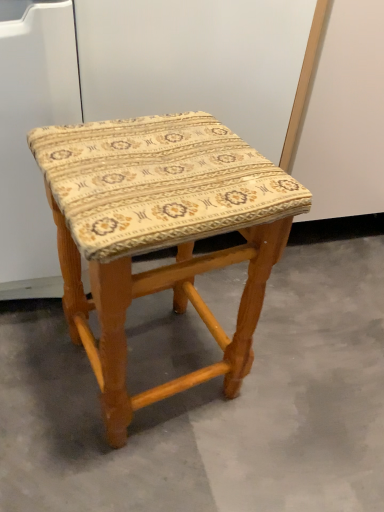
Question: Are beige fabric stool at center and wooden stool at center making contact?

Choices:
 (A) no
 (B) yes

Answer: (A)

Question: Does beige fabric stool at center appear on the right side of wooden stool at center?

Choices:
 (A) yes
 (B) no

Answer: (A)

Question: Does beige fabric stool at center have a smaller size compared to wooden stool at center?

Choices:
 (A) no
 (B) yes

Answer: (B)

Question: Does beige fabric stool at center have a lesser width compared to wooden stool at center?

Choices:
 (A) no
 (B) yes

Answer: (A)

Question: From the image's perspective, is beige fabric stool at center on top of wooden stool at center?

Choices:
 (A) yes
 (B) no

Answer: (B)

Question: Can you confirm if beige fabric stool at center is positioned to the left of wooden stool at center?

Choices:
 (A) yes
 (B) no

Answer: (B)

Question: Is wooden stool at center to the right of beige fabric stool at center from the viewer's perspective?

Choices:
 (A) yes
 (B) no

Answer: (B)

Question: Does wooden stool at center lie behind beige fabric stool at center?

Choices:
 (A) yes
 (B) no

Answer: (B)

Question: Does wooden stool at center turn towards beige fabric stool at center?

Choices:
 (A) no
 (B) yes

Answer: (A)

Question: Considering the relative sizes of wooden stool at center and beige fabric stool at center in the image provided, is wooden stool at center shorter than beige fabric stool at center?

Choices:
 (A) yes
 (B) no

Answer: (B)

Question: From the image's perspective, is wooden stool at center on top of beige fabric stool at center?

Choices:
 (A) yes
 (B) no

Answer: (A)

Question: From a real-world perspective, is wooden stool at center on top of beige fabric stool at center?

Choices:
 (A) no
 (B) yes

Answer: (B)

Question: Does point (124, 270) appear closer or farther from the camera than point (349, 274)?

Choices:
 (A) closer
 (B) farther

Answer: (A)